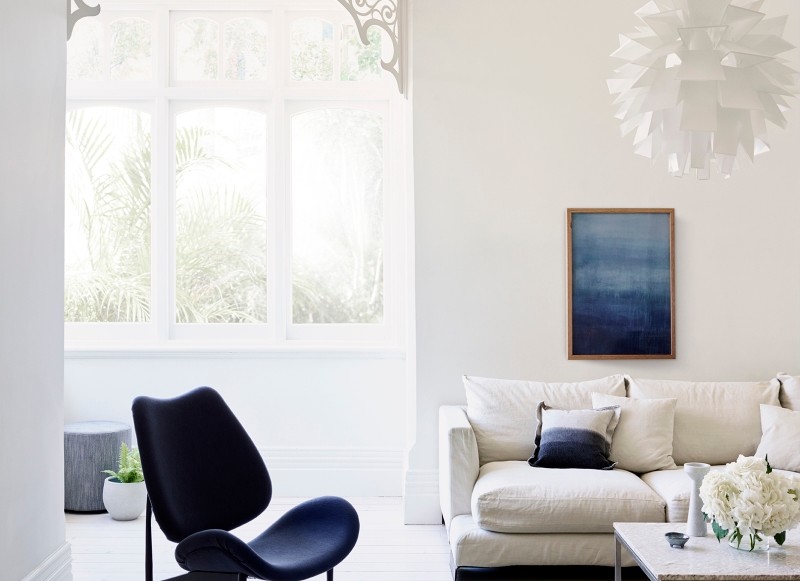
Image resolution: width=800 pixels, height=581 pixels. I want to click on pillow, so click(x=790, y=435).